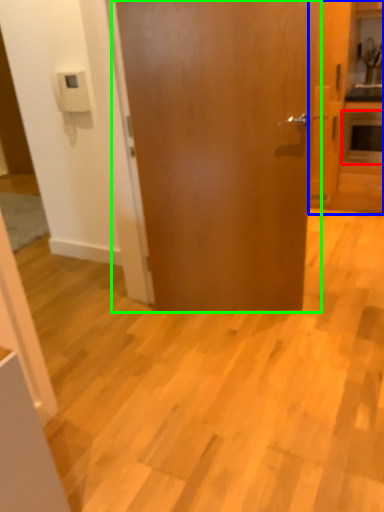
Question: Which object is the farthest from appliance (highlighted by a red box)? Choose among these: cabinetry (highlighted by a blue box) or door (highlighted by a green box).

Choices:
 (A) cabinetry
 (B) door

Answer: (B)